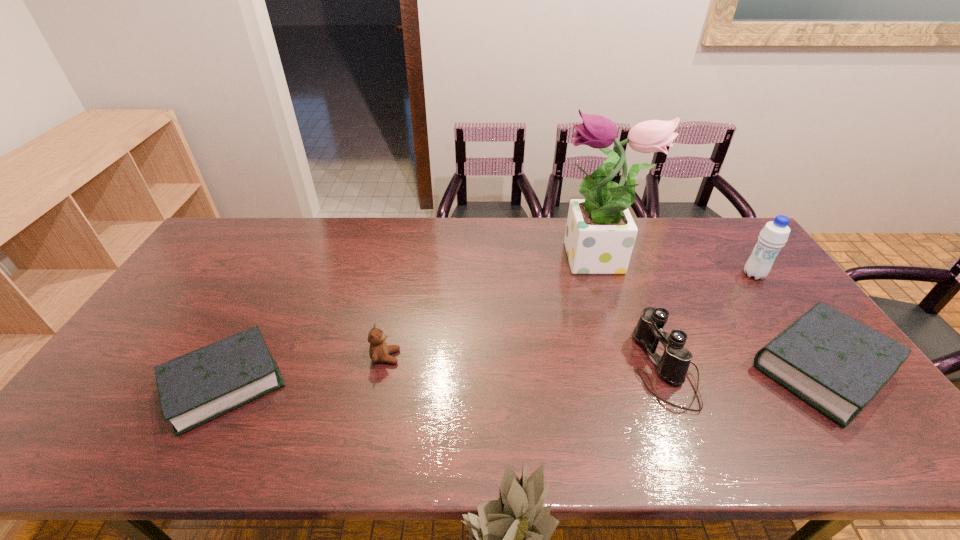
If equal spacing is desired by inserting an extra Bible among them, please point out a free spot for this new Bible. Please provide its 2D coordinates. Your answer should be formatted as a tuple, i.e. [(x, y)], where the tuple contains the x and y coordinates of a point satisfying the conditions above.

[(529, 375)]